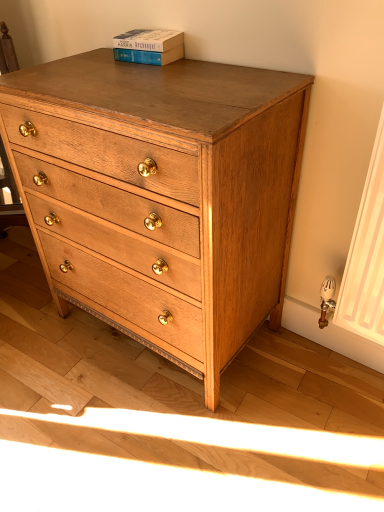
Question: Is blue cardboard book at upper center shorter than natural wood chest of drawers at center?

Choices:
 (A) yes
 (B) no

Answer: (A)

Question: From a real-world perspective, is blue cardboard book at upper center positioned under natural wood chest of drawers at center based on gravity?

Choices:
 (A) yes
 (B) no

Answer: (B)

Question: Is blue cardboard book at upper center further to the viewer compared to natural wood chest of drawers at center?

Choices:
 (A) no
 (B) yes

Answer: (B)

Question: Would you say natural wood chest of drawers at center is part of blue cardboard book at upper center's contents?

Choices:
 (A) no
 (B) yes

Answer: (A)

Question: Is blue cardboard book at upper center positioned in front of natural wood chest of drawers at center?

Choices:
 (A) no
 (B) yes

Answer: (A)

Question: Could you tell me if blue cardboard book at upper center is facing natural wood chest of drawers at center?

Choices:
 (A) no
 (B) yes

Answer: (A)

Question: From the image's perspective, is natural wood chest of drawers at center above blue cardboard book at upper center?

Choices:
 (A) no
 (B) yes

Answer: (A)

Question: From a real-world perspective, is natural wood chest of drawers at center physically above blue cardboard book at upper center?

Choices:
 (A) yes
 (B) no

Answer: (B)

Question: Does natural wood chest of drawers at center turn towards blue cardboard book at upper center?

Choices:
 (A) yes
 (B) no

Answer: (B)

Question: Is natural wood chest of drawers at center far from blue cardboard book at upper center?

Choices:
 (A) yes
 (B) no

Answer: (B)

Question: Is natural wood chest of drawers at center next to blue cardboard book at upper center and touching it?

Choices:
 (A) yes
 (B) no

Answer: (B)

Question: Is natural wood chest of drawers at center closer to the viewer compared to blue cardboard book at upper center?

Choices:
 (A) yes
 (B) no

Answer: (A)

Question: From a real-world perspective, is blue cardboard book at upper center physically located above or below natural wood chest of drawers at center?

Choices:
 (A) below
 (B) above

Answer: (B)